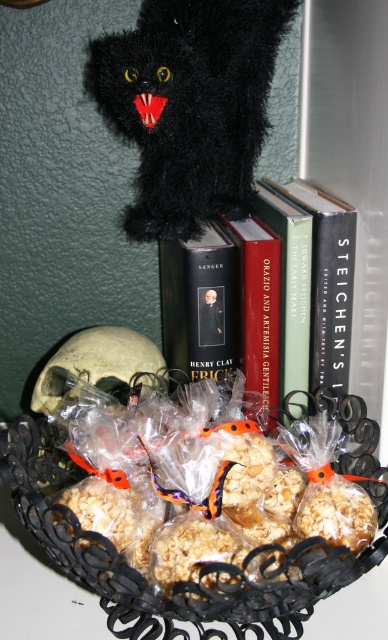
Is black plastic basket at lower center below hardcover book at center?

Yes.

Between black plastic basket at lower center and hardcover book at center, which one appears on the right side from the viewer's perspective?

hardcover book at center is more to the right.

Where is `black plastic basket at lower center`? The width and height of the screenshot is (388, 640). black plastic basket at lower center is located at coordinates (207, 564).

Does fuzzy black cat at upper center have a greater height compared to hardcover book at center?

Indeed, fuzzy black cat at upper center has a greater height compared to hardcover book at center.

Is fuzzy black cat at upper center thinner than hardcover book at center?

In fact, fuzzy black cat at upper center might be wider than hardcover book at center.

Where is `fuzzy black cat at upper center`? The height and width of the screenshot is (640, 388). fuzzy black cat at upper center is located at coordinates (190, 106).

Does fuzzy black cat at upper center appear on the left side of black plastic basket at lower center?

Correct, you'll find fuzzy black cat at upper center to the left of black plastic basket at lower center.

Which is in front, point (114, 92) or point (346, 560)?

Point (346, 560)

Does point (207, 60) lie behind point (301, 614)?

That is True.

What are the coordinates of `fuzzy black cat at upper center` in the screenshot? It's located at (190, 106).